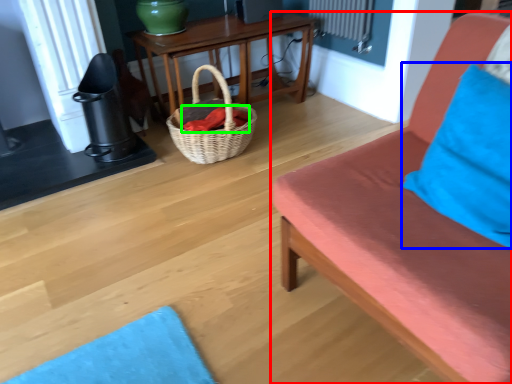
Question: Based on their relative distances, which object is nearer to studio couch (highlighted by a red box)? Choose from pillow (highlighted by a blue box) and material (highlighted by a green box).

Choices:
 (A) pillow
 (B) material

Answer: (A)